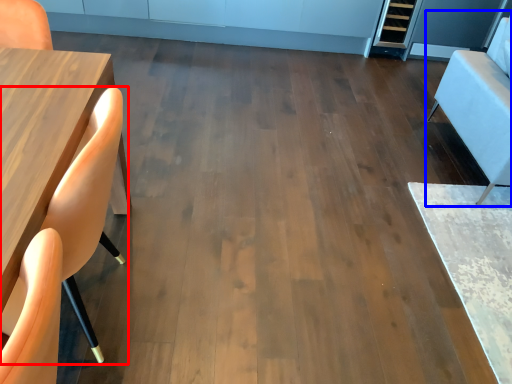
Question: Which object is closer to the camera taking this photo, chair (highlighted by a red box) or armchair (highlighted by a blue box)?

Choices:
 (A) chair
 (B) armchair

Answer: (A)